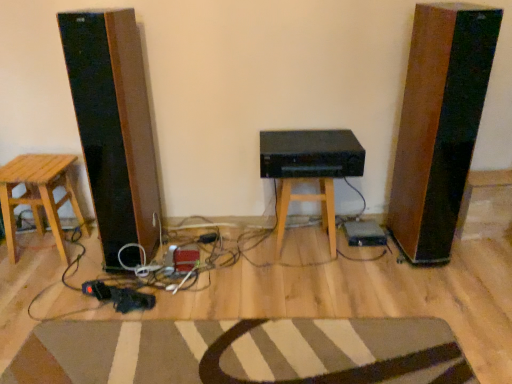
The image size is (512, 384). Describe the element at coordinates (307, 201) in the screenshot. I see `wooden stool at center, the second stool when ordered from left to right` at that location.

What is the approximate width of wooden stool at left, acting as the second stool starting from the right?

It is 14.02 inches.

What do you see at coordinates (242, 352) in the screenshot?
I see `striped wool doormat at lower center` at bounding box center [242, 352].

The height and width of the screenshot is (384, 512). Describe the element at coordinates (310, 154) in the screenshot. I see `black matte speaker at center` at that location.

At what (x,y) coordinates should I click in order to perform the action: click on wooden stool at center, the second stool when ordered from left to right. Please return your answer as a coordinate pair (x, y). The image size is (512, 384). Looking at the image, I should click on tap(307, 201).

How many degrees apart are the facing directions of striped wool doormat at lower center and wooden stool at center, which is the first stool in right-to-left order?

striped wool doormat at lower center and wooden stool at center, which is the first stool in right-to-left order, are facing 92.9 degrees away from each other.

Between striped wool doormat at lower center and wooden stool at center, the second stool when ordered from left to right, which one appears on the right side from the viewer's perspective?

wooden stool at center, the second stool when ordered from left to right, is more to the right.

From a real-world perspective, is striped wool doormat at lower center beneath wooden stool at center, which is the first stool in right-to-left order?

Indeed, from a real-world perspective, striped wool doormat at lower center is positioned beneath wooden stool at center, which is the first stool in right-to-left order.

Is wooden stool at center, the second stool when ordered from left to right, aimed at wooden stool at left, acting as the second stool starting from the right?

No, wooden stool at center, the second stool when ordered from left to right, is not facing towards wooden stool at left, acting as the second stool starting from the right.

Considering the points (286, 184) and (60, 175), which point is behind, point (286, 184) or point (60, 175)?

The point (60, 175) is more distant.

Is wooden stool at center, which is the first stool in right-to-left order, next to wooden stool at left, arranged as the 1th stool when viewed from the left?

wooden stool at center, which is the first stool in right-to-left order, and wooden stool at left, arranged as the 1th stool when viewed from the left, are not in contact.

Considering the sizes of objects wooden stool at center, which is the first stool in right-to-left order, and wooden stool at left, arranged as the 1th stool when viewed from the left, in the image provided, who is smaller, wooden stool at center, which is the first stool in right-to-left order, or wooden stool at left, arranged as the 1th stool when viewed from the left,?

wooden stool at center, which is the first stool in right-to-left order.

Does black matte speaker at center touch striped wool doormat at lower center?

black matte speaker at center is not next to striped wool doormat at lower center, and they're not touching.

From the picture: From the image's perspective, is black matte speaker at center over striped wool doormat at lower center?

Yes, from the image's perspective, black matte speaker at center is above striped wool doormat at lower center.

Does point (343, 151) come behind point (255, 321)?

Yes, it is behind point (255, 321).

Between black matte speaker at center and striped wool doormat at lower center, which one has smaller width?

With smaller width is black matte speaker at center.

Which is farther, (281, 154) or (13, 161)?

Point (13, 161)

From a real-world perspective, between black matte speaker at center and wooden stool at left, arranged as the 1th stool when viewed from the left, who is vertically lower?

In real-world perspective, wooden stool at left, arranged as the 1th stool when viewed from the left, is lower.

Is black matte speaker at center bigger or smaller than wooden stool at left, acting as the second stool starting from the right?

In the image, black matte speaker at center appears to be smaller than wooden stool at left, acting as the second stool starting from the right.

Consider the image. Would you say black matte speaker at center is outside wooden stool at left, arranged as the 1th stool when viewed from the left?

That's correct, black matte speaker at center is outside of wooden stool at left, arranged as the 1th stool when viewed from the left.

Considering the sizes of objects wooden stool at left, arranged as the 1th stool when viewed from the left, and striped wool doormat at lower center in the image provided, who is taller, wooden stool at left, arranged as the 1th stool when viewed from the left, or striped wool doormat at lower center?

With more height is wooden stool at left, arranged as the 1th stool when viewed from the left.

Between wooden stool at left, acting as the second stool starting from the right, and striped wool doormat at lower center, which one appears on the right side from the viewer's perspective?

From the viewer's perspective, striped wool doormat at lower center appears more on the right side.

Can you see wooden stool at left, arranged as the 1th stool when viewed from the left, touching striped wool doormat at lower center?

No, wooden stool at left, arranged as the 1th stool when viewed from the left, is not with striped wool doormat at lower center.

From the image's perspective, between wooden stool at left, arranged as the 1th stool when viewed from the left, and striped wool doormat at lower center, which one is located above?

From the image's view, wooden stool at left, arranged as the 1th stool when viewed from the left, is above.

Between wooden stool at center, which is the first stool in right-to-left order, and black matte speaker at center, which one appears on the left side from the viewer's perspective?

wooden stool at center, which is the first stool in right-to-left order, is more to the left.

Considering the relative sizes of wooden stool at center, the second stool when ordered from left to right, and black matte speaker at center in the image provided, is wooden stool at center, the second stool when ordered from left to right, shorter than black matte speaker at center?

No, wooden stool at center, the second stool when ordered from left to right, is not shorter than black matte speaker at center.

Which of these two, wooden stool at center, the second stool when ordered from left to right, or black matte speaker at center, is bigger?

Bigger between the two is wooden stool at center, the second stool when ordered from left to right.

Based on their sizes in the image, would you say black matte speaker at center is bigger or smaller than wooden stool at center, the second stool when ordered from left to right?

In the image, black matte speaker at center appears to be smaller than wooden stool at center, the second stool when ordered from left to right.

From a real-world perspective, is black matte speaker at center below wooden stool at center, which is the first stool in right-to-left order?

Actually, black matte speaker at center is physically above wooden stool at center, which is the first stool in right-to-left order, in the real world.

Can you confirm if black matte speaker at center is thinner than wooden stool at center, which is the first stool in right-to-left order?

No, black matte speaker at center is not thinner than wooden stool at center, which is the first stool in right-to-left order.

Identify the location of doormat located in front of the wooden stool at center, which is the first stool in right-to-left order. This screenshot has height=384, width=512. (242, 352).

At what (x,y) coordinates should I click in order to perform the action: click on stool behind the wooden stool at left, acting as the second stool starting from the right. Please return your answer as a coordinate pair (x, y). The height and width of the screenshot is (384, 512). Looking at the image, I should click on (307, 201).

Based on their spatial positions, is wooden stool at center, which is the first stool in right-to-left order, or wooden stool at left, arranged as the 1th stool when viewed from the left, further from striped wool doormat at lower center?

wooden stool at left, arranged as the 1th stool when viewed from the left.

Based on their spatial positions, is black matte speaker at center or wooden stool at center, which is the first stool in right-to-left order, further from wooden stool at left, arranged as the 1th stool when viewed from the left?

Among the two, wooden stool at center, which is the first stool in right-to-left order, is located further to wooden stool at left, arranged as the 1th stool when viewed from the left.

Looking at this image, looking at the image, which one is located further to wooden stool at left, arranged as the 1th stool when viewed from the left, wooden stool at center, the second stool when ordered from left to right, or black matte speaker at center?

wooden stool at center, the second stool when ordered from left to right, is further to wooden stool at left, arranged as the 1th stool when viewed from the left.

Based on their spatial positions, is black matte speaker at center or striped wool doormat at lower center further from wooden stool at center, the second stool when ordered from left to right?

The object further to wooden stool at center, the second stool when ordered from left to right, is striped wool doormat at lower center.

Estimate the real-world distances between objects in this image. Which object is further from wooden stool at center, which is the first stool in right-to-left order, wooden stool at left, acting as the second stool starting from the right, or black matte speaker at center?

wooden stool at left, acting as the second stool starting from the right.

Estimate the real-world distances between objects in this image. Which object is closer to wooden stool at center, the second stool when ordered from left to right, black matte speaker at center or wooden stool at left, acting as the second stool starting from the right?

The object closer to wooden stool at center, the second stool when ordered from left to right, is black matte speaker at center.

Which object lies nearer to the anchor point black matte speaker at center, wooden stool at center, which is the first stool in right-to-left order, or striped wool doormat at lower center?

wooden stool at center, which is the first stool in right-to-left order, is positioned closer to the anchor black matte speaker at center.

Which object lies further to the anchor point wooden stool at center, the second stool when ordered from left to right, wooden stool at left, acting as the second stool starting from the right, or striped wool doormat at lower center?

wooden stool at left, acting as the second stool starting from the right, lies further to wooden stool at center, the second stool when ordered from left to right, than the other object.

Where is `stool between wooden stool at left, acting as the second stool starting from the right, and black matte speaker at center`? Image resolution: width=512 pixels, height=384 pixels. stool between wooden stool at left, acting as the second stool starting from the right, and black matte speaker at center is located at coordinates (307, 201).

I want to click on doormat located between wooden stool at left, acting as the second stool starting from the right, and wooden stool at center, the second stool when ordered from left to right, in the left-right direction, so click(x=242, y=352).

Find the location of a particular element. The image size is (512, 384). doormat between wooden stool at left, acting as the second stool starting from the right, and black matte speaker at center from left to right is located at coordinates (242, 352).